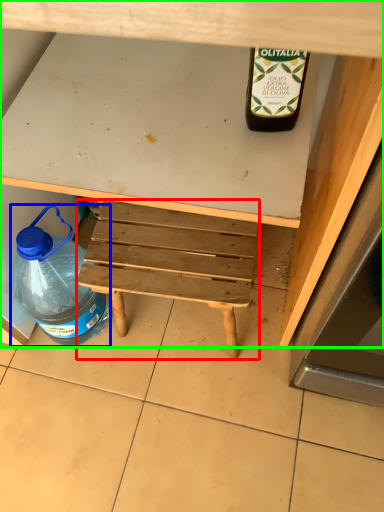
Question: Which is farther away from stool (highlighted by a red box)? bottle (highlighted by a blue box) or desk (highlighted by a green box)?

Choices:
 (A) bottle
 (B) desk

Answer: (B)